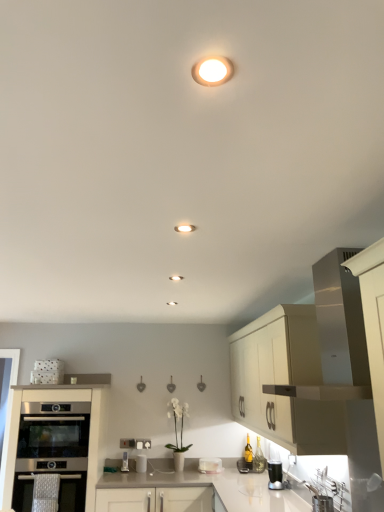
Question: From a real-world perspective, is metallic silver toaster at lower center, marked as the 1th appliance in a left-to-right arrangement, beneath white glossy countertop at center?

Choices:
 (A) yes
 (B) no

Answer: (B)

Question: Can you confirm if metallic silver toaster at lower center, marked as the 1th appliance in a left-to-right arrangement, is positioned to the left of white glossy countertop at center?

Choices:
 (A) no
 (B) yes

Answer: (B)

Question: Does metallic silver toaster at lower center, marked as the 1th appliance in a left-to-right arrangement, come behind white glossy countertop at center?

Choices:
 (A) no
 (B) yes

Answer: (B)

Question: Is white glossy countertop at center completely or partially inside metallic silver toaster at lower center, arranged as the second appliance when viewed from the right?

Choices:
 (A) yes
 (B) no

Answer: (B)

Question: Considering the relative positions of metallic silver toaster at lower center, arranged as the second appliance when viewed from the right, and white glossy countertop at center in the image provided, is metallic silver toaster at lower center, arranged as the second appliance when viewed from the right, in front of white glossy countertop at center?

Choices:
 (A) yes
 (B) no

Answer: (B)

Question: From the image's perspective, is metallic silver toaster at lower center, arranged as the second appliance when viewed from the right, over white glossy countertop at center?

Choices:
 (A) yes
 (B) no

Answer: (A)

Question: Does satin silver oven at lower left, positioned as the second cabinetry in right-to-left order, have a greater height compared to translucent glass bottle at lower right?

Choices:
 (A) no
 (B) yes

Answer: (B)

Question: Does satin silver oven at lower left, positioned as the second cabinetry in right-to-left order, have a greater width compared to translucent glass bottle at lower right?

Choices:
 (A) no
 (B) yes

Answer: (B)

Question: Is satin silver oven at lower left, acting as the first cabinetry starting from the left, far away from translucent glass bottle at lower right?

Choices:
 (A) yes
 (B) no

Answer: (A)

Question: Is satin silver oven at lower left, positioned as the second cabinetry in right-to-left order, turned away from translucent glass bottle at lower right?

Choices:
 (A) no
 (B) yes

Answer: (A)

Question: Is translucent glass bottle at lower right located within satin silver oven at lower left, acting as the first cabinetry starting from the left?

Choices:
 (A) yes
 (B) no

Answer: (B)

Question: Is satin silver oven at lower left, acting as the first cabinetry starting from the left, completely or partially outside of translucent glass bottle at lower right?

Choices:
 (A) yes
 (B) no

Answer: (A)

Question: Is white glossy toaster at lower center, which is the second appliance in left-to-right order, positioned with its back to metallic silver toaster at lower center, marked as the 1th appliance in a left-to-right arrangement?

Choices:
 (A) no
 (B) yes

Answer: (A)